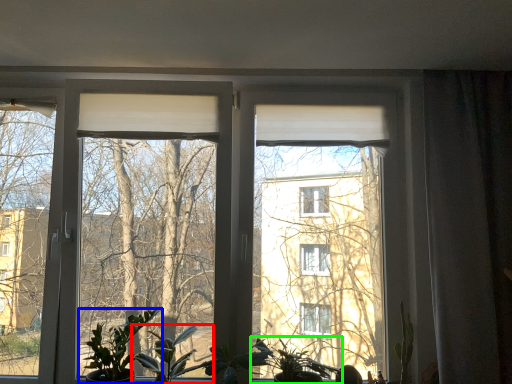
Question: Which object is positioned closest to houseplant (highlighted by a red box)? Select from houseplant (highlighted by a blue box) and houseplant (highlighted by a green box).

Choices:
 (A) houseplant
 (B) houseplant

Answer: (A)